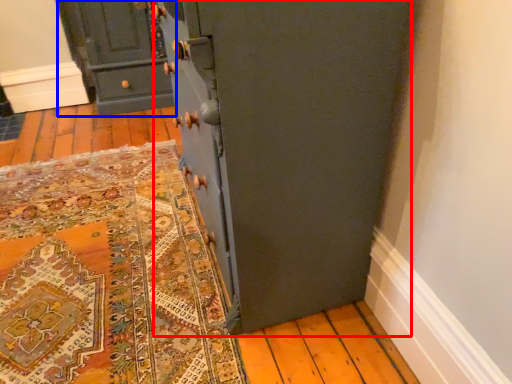
Question: Which object appears farthest to the camera in this image, cupboard (highlighted by a red box) or chest of drawers (highlighted by a blue box)?

Choices:
 (A) cupboard
 (B) chest of drawers

Answer: (B)